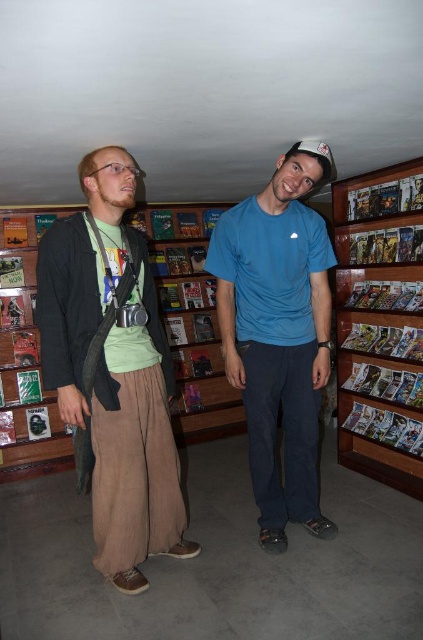
Is wooden bookshelf at center below wooden bookshelf at right?

No.

Between point (227, 410) and point (348, 444), which one is positioned behind?

The point (227, 410) is more distant.

The image size is (423, 640). What do you see at coordinates (189, 317) in the screenshot?
I see `wooden bookshelf at center` at bounding box center [189, 317].

You are a GUI agent. You are given a task and a screenshot of the screen. Output one action in this format:
    pyautogui.click(x=<x>, y=<y>)
    Task: Click on the wooden bookshelf at center
    
    Given the screenshot: What is the action you would take?
    pyautogui.click(x=189, y=317)

Does blue cotton t-shirt at center have a larger size compared to wooden bookshelf at center?

No, blue cotton t-shirt at center is not bigger than wooden bookshelf at center.

Which is in front, point (324, 230) or point (224, 392)?

Positioned in front is point (324, 230).

Between point (266, 214) and point (167, 248), which one is positioned behind?

The point (167, 248) is more distant.

At what (x,y) coordinates should I click in order to perform the action: click on blue cotton t-shirt at center. Please return your answer as a coordinate pair (x, y). This screenshot has width=423, height=640. Looking at the image, I should click on (279, 333).

Does blue cotton t-shirt at center appear under wooden bookshelf at right?

Yes, blue cotton t-shirt at center is below wooden bookshelf at right.

Does blue cotton t-shirt at center appear on the right side of wooden bookshelf at right?

No, blue cotton t-shirt at center is not to the right of wooden bookshelf at right.

Image resolution: width=423 pixels, height=640 pixels. Find the location of `blue cotton t-shirt at center`. blue cotton t-shirt at center is located at coordinates (279, 333).